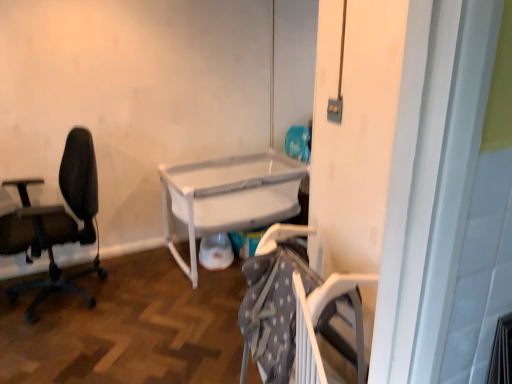
Question: Is white plastic screen door at center wider or thinner than white plastic crib at center?

Choices:
 (A) wide
 (B) thin

Answer: (B)

Question: From a real-world perspective, is white plastic screen door at center positioned above or below white plastic crib at center?

Choices:
 (A) below
 (B) above

Answer: (B)

Question: Which of these objects is positioned closest to the white plastic screen door at center?

Choices:
 (A) white plastic crib at center
 (B) black mesh office chair at left

Answer: (A)

Question: Which of these objects is positioned farthest from the white plastic crib at center?

Choices:
 (A) black mesh office chair at left
 (B) white plastic screen door at center

Answer: (B)